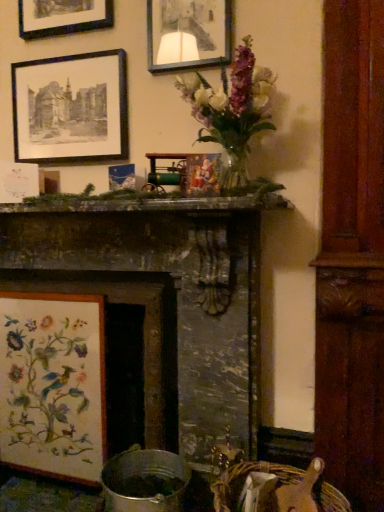
Question: Should I look upward or downward to see wooden floral embroidery at lower left, which appears as the 3th picture frame when viewed from the top?

Choices:
 (A) down
 (B) up

Answer: (A)

Question: From a real-world perspective, is black paper picture frame at upper left, which is the 2th picture frame in top-to-bottom order, positioned under dark gray stone fireplace at center based on gravity?

Choices:
 (A) yes
 (B) no

Answer: (B)

Question: Is black paper picture frame at upper left, acting as the 2th picture frame starting from the bottom, facing away from dark gray stone fireplace at center?

Choices:
 (A) yes
 (B) no

Answer: (B)

Question: From the image's perspective, is black paper picture frame at upper left, acting as the 2th picture frame starting from the bottom, on top of dark gray stone fireplace at center?

Choices:
 (A) no
 (B) yes

Answer: (B)

Question: Considering the relative sizes of black paper picture frame at upper left, acting as the 2th picture frame starting from the bottom, and dark gray stone fireplace at center in the image provided, is black paper picture frame at upper left, acting as the 2th picture frame starting from the bottom, taller than dark gray stone fireplace at center?

Choices:
 (A) yes
 (B) no

Answer: (B)

Question: Does black paper picture frame at upper left, which is the 2th picture frame in top-to-bottom order, have a lesser width compared to dark gray stone fireplace at center?

Choices:
 (A) no
 (B) yes

Answer: (B)

Question: Does black paper picture frame at upper left, acting as the 2th picture frame starting from the bottom, touch dark gray stone fireplace at center?

Choices:
 (A) yes
 (B) no

Answer: (B)

Question: Is matte glass picture frame at upper center, which appears as the third picture frame when ordered from the bottom, positioned far away from wooden floral embroidery at lower left, which appears as the 3th picture frame when viewed from the top?

Choices:
 (A) yes
 (B) no

Answer: (A)

Question: Is matte glass picture frame at upper center, which appears as the third picture frame when ordered from the bottom, outside wooden floral embroidery at lower left, which appears as the 3th picture frame when viewed from the top?

Choices:
 (A) yes
 (B) no

Answer: (A)

Question: Is matte glass picture frame at upper center, which appears as the third picture frame when ordered from the bottom, positioned in front of wooden floral embroidery at lower left, which appears as the 3th picture frame when viewed from the top?

Choices:
 (A) yes
 (B) no

Answer: (A)

Question: From the image's perspective, is matte glass picture frame at upper center, which appears as the 1th picture frame when viewed from the top, below wooden floral embroidery at lower left, the first picture frame from the bottom?

Choices:
 (A) yes
 (B) no

Answer: (B)

Question: Does matte glass picture frame at upper center, which appears as the 1th picture frame when viewed from the top, have a greater height compared to wooden floral embroidery at lower left, which appears as the 3th picture frame when viewed from the top?

Choices:
 (A) yes
 (B) no

Answer: (B)

Question: Is matte glass picture frame at upper center, which appears as the third picture frame when ordered from the bottom, shorter than wooden floral embroidery at lower left, which appears as the 3th picture frame when viewed from the top?

Choices:
 (A) yes
 (B) no

Answer: (A)

Question: Is black paper picture frame at upper left, which is the 2th picture frame in top-to-bottom order, to the left of woven straw basket at lower right from the viewer's perspective?

Choices:
 (A) no
 (B) yes

Answer: (B)